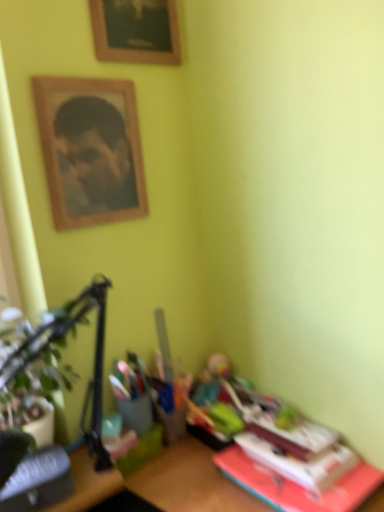
Question: Considering the positions of green leafy plant at left and hardcover book at lower right, the first paperback book in the right-to-left sequence, in the image, is green leafy plant at left wider or thinner than hardcover book at lower right, the first paperback book in the right-to-left sequence,?

Choices:
 (A) wide
 (B) thin

Answer: (B)

Question: Considering the positions of green leafy plant at left and hardcover book at lower right, the first paperback book in the right-to-left sequence, in the image, is green leafy plant at left bigger or smaller than hardcover book at lower right, the first paperback book in the right-to-left sequence,?

Choices:
 (A) big
 (B) small

Answer: (A)

Question: Which object is the farthest from the wooden framed portrait at upper left?

Choices:
 (A) hardcover book at lower right, which is counted as the second paperback book, starting from the left
 (B) wooden picture frame at upper center
 (C) hardcover book at lower left, positioned as the 2th paperback book in right-to-left order
 (D) green leafy plant at left

Answer: (A)

Question: Based on their relative distances, which object is nearer to the wooden picture frame at upper center?

Choices:
 (A) hardcover book at lower right, which is counted as the second paperback book, starting from the left
 (B) wooden framed portrait at upper left
 (C) green leafy plant at left
 (D) hardcover book at lower left, positioned as the 2th paperback book in right-to-left order

Answer: (B)